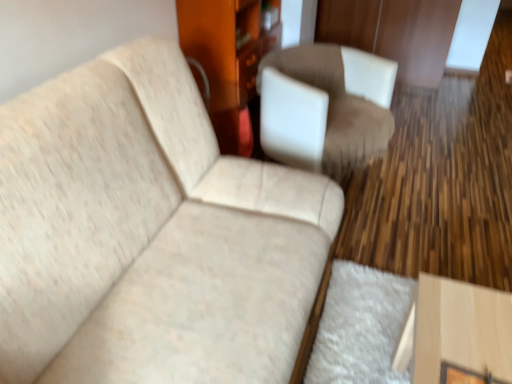
Question: Considering the relative sizes of wooden dresser at center and beige fabric couch at upper left in the image provided, is wooden dresser at center thinner than beige fabric couch at upper left?

Choices:
 (A) no
 (B) yes

Answer: (B)

Question: Can you confirm if wooden dresser at center is smaller than beige fabric couch at upper left?

Choices:
 (A) yes
 (B) no

Answer: (A)

Question: Is wooden dresser at center aimed at beige fabric couch at upper left?

Choices:
 (A) no
 (B) yes

Answer: (A)

Question: Does wooden dresser at center appear on the right side of beige fabric couch at upper left?

Choices:
 (A) no
 (B) yes

Answer: (B)

Question: From the image's perspective, would you say wooden dresser at center is shown under beige fabric couch at upper left?

Choices:
 (A) yes
 (B) no

Answer: (B)

Question: From a real-world perspective, is beige fabric couch at upper left positioned above or below wooden dresser at center?

Choices:
 (A) below
 (B) above

Answer: (B)

Question: Visually, is beige fabric couch at upper left positioned to the left or to the right of wooden dresser at center?

Choices:
 (A) left
 (B) right

Answer: (A)

Question: Is point (148, 291) positioned closer to the camera than point (221, 120)?

Choices:
 (A) farther
 (B) closer

Answer: (B)

Question: Considering the positions of beige fabric couch at upper left and wooden dresser at center in the image, is beige fabric couch at upper left bigger or smaller than wooden dresser at center?

Choices:
 (A) big
 (B) small

Answer: (A)

Question: From their relative heights in the image, would you say suede-like brown chair at center is taller or shorter than wooden dresser at center?

Choices:
 (A) short
 (B) tall

Answer: (A)

Question: In terms of size, does suede-like brown chair at center appear bigger or smaller than wooden dresser at center?

Choices:
 (A) big
 (B) small

Answer: (B)

Question: From the image's perspective, relative to wooden dresser at center, is suede-like brown chair at center above or below?

Choices:
 (A) above
 (B) below

Answer: (B)

Question: Would you say suede-like brown chair at center is to the left or to the right of wooden dresser at center in the picture?

Choices:
 (A) left
 (B) right

Answer: (B)

Question: In the image, is wooden dresser at center positioned in front of or behind suede-like brown chair at center?

Choices:
 (A) behind
 (B) front

Answer: (A)

Question: Is wooden dresser at center spatially inside suede-like brown chair at center, or outside of it?

Choices:
 (A) outside
 (B) inside

Answer: (A)